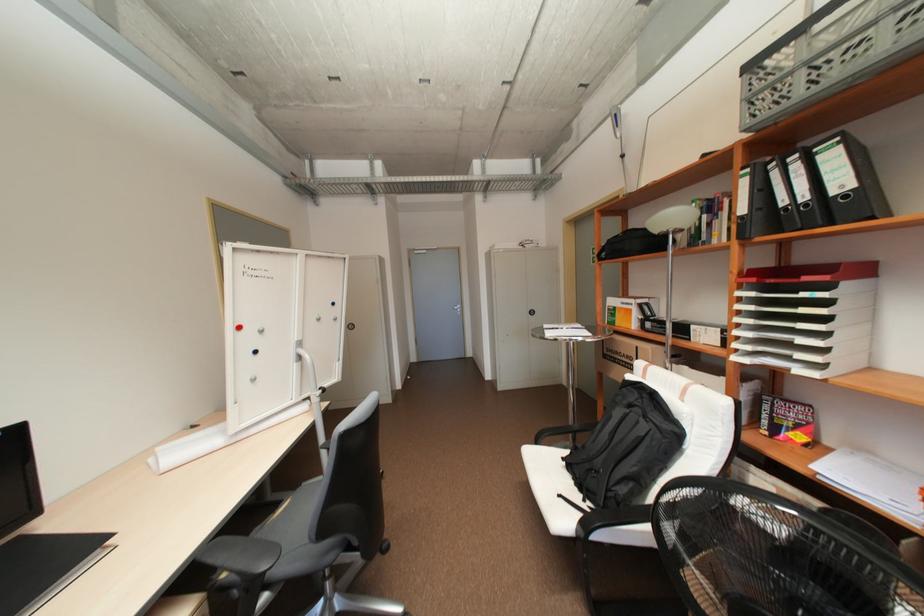
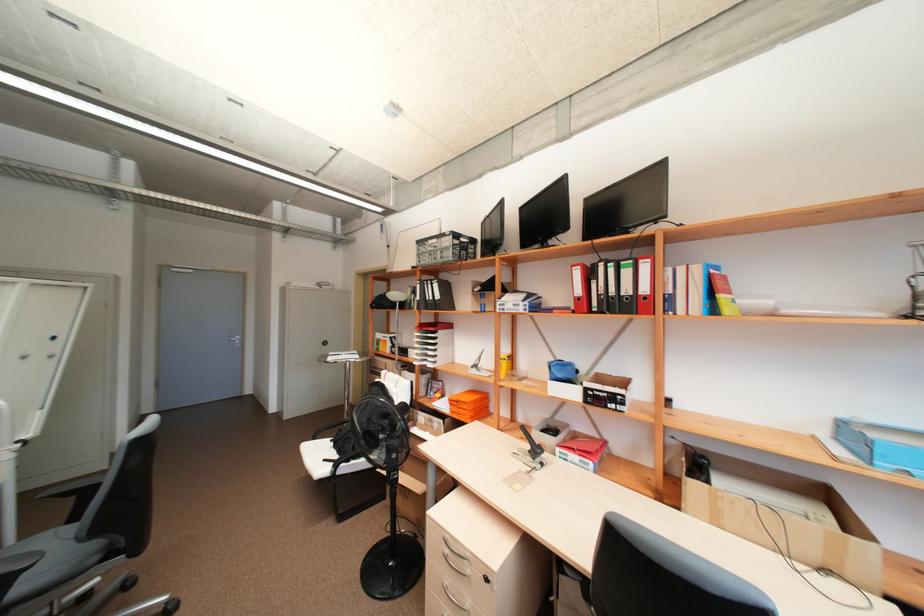
In the second image, find the point that corresponds to the point at 553,334 in the first image.

(334, 359)